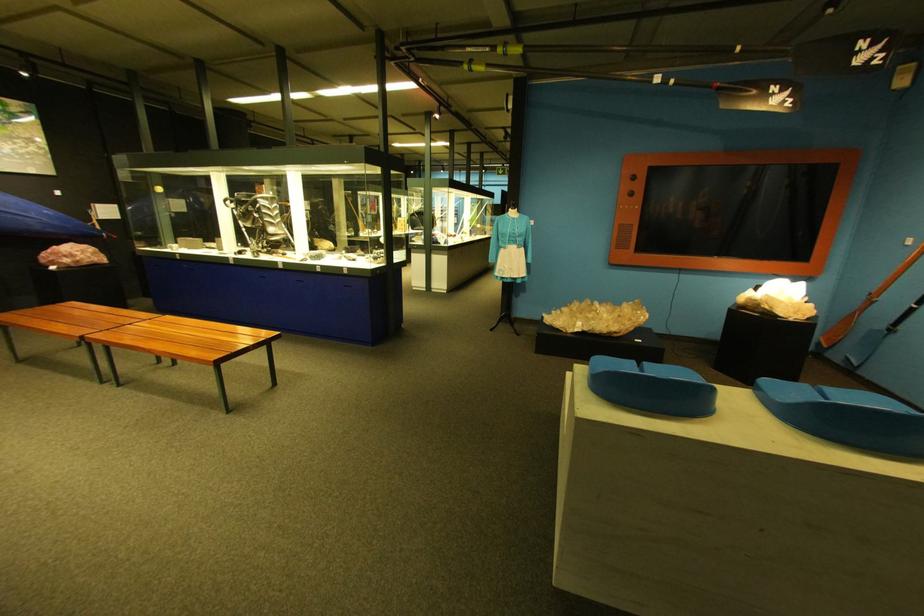
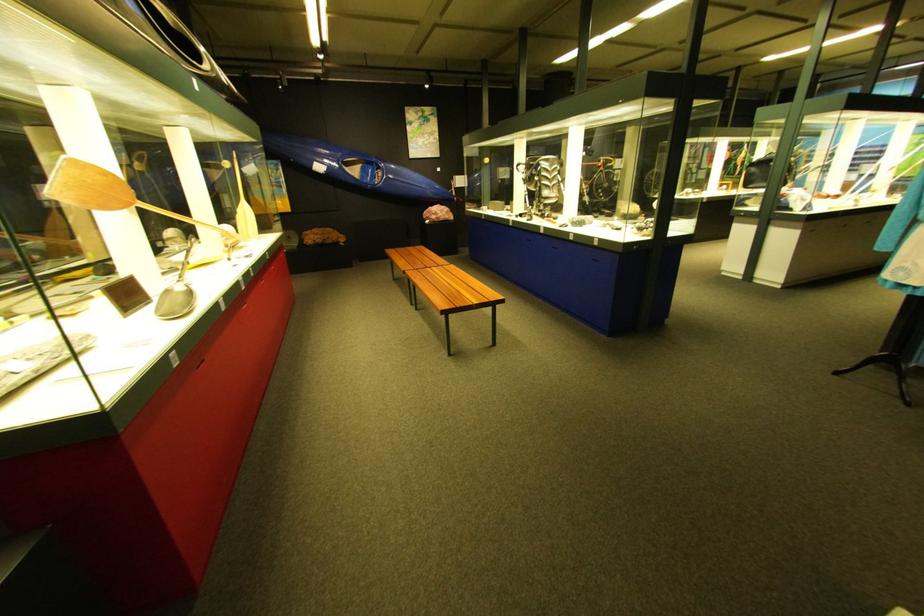
Locate, in the second image, the point that corresponds to point (430, 220) in the first image.

(769, 172)